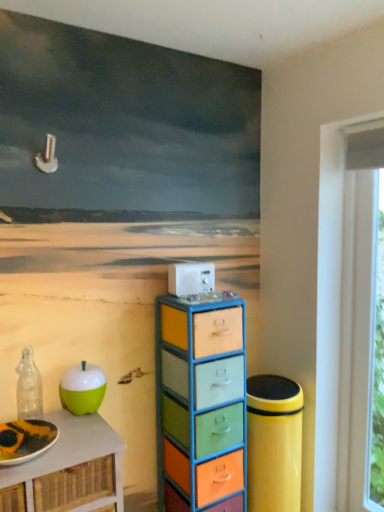
Question: From the image's perspective, would you say multicolored painted drawers at center is positioned over green matte apple at lower left?

Choices:
 (A) yes
 (B) no

Answer: (B)

Question: Does multicolored painted drawers at center come behind green matte apple at lower left?

Choices:
 (A) yes
 (B) no

Answer: (A)

Question: Is multicolored painted drawers at center far from green matte apple at lower left?

Choices:
 (A) yes
 (B) no

Answer: (B)

Question: Can you confirm if multicolored painted drawers at center is wider than green matte apple at lower left?

Choices:
 (A) yes
 (B) no

Answer: (A)

Question: Could you tell me if multicolored painted drawers at center is facing green matte apple at lower left?

Choices:
 (A) no
 (B) yes

Answer: (A)

Question: Is multicolored painted drawers at center positioned with its back to green matte apple at lower left?

Choices:
 (A) yes
 (B) no

Answer: (B)

Question: From a real-world perspective, is multicolored painted drawers at center on top of green matte apple at left?

Choices:
 (A) yes
 (B) no

Answer: (A)

Question: Could green matte apple at left be considered to be inside multicolored painted drawers at center?

Choices:
 (A) yes
 (B) no

Answer: (B)

Question: Is multicolored painted drawers at center positioned with its back to green matte apple at left?

Choices:
 (A) no
 (B) yes

Answer: (A)

Question: Can you confirm if multicolored painted drawers at center is bigger than green matte apple at left?

Choices:
 (A) yes
 (B) no

Answer: (A)

Question: Can you confirm if multicolored painted drawers at center is shorter than green matte apple at left?

Choices:
 (A) yes
 (B) no

Answer: (B)

Question: Is multicolored painted drawers at center to the left of green matte apple at left from the viewer's perspective?

Choices:
 (A) no
 (B) yes

Answer: (A)

Question: Is green matte apple at left further to camera compared to white plastic appliance at center?

Choices:
 (A) yes
 (B) no

Answer: (B)